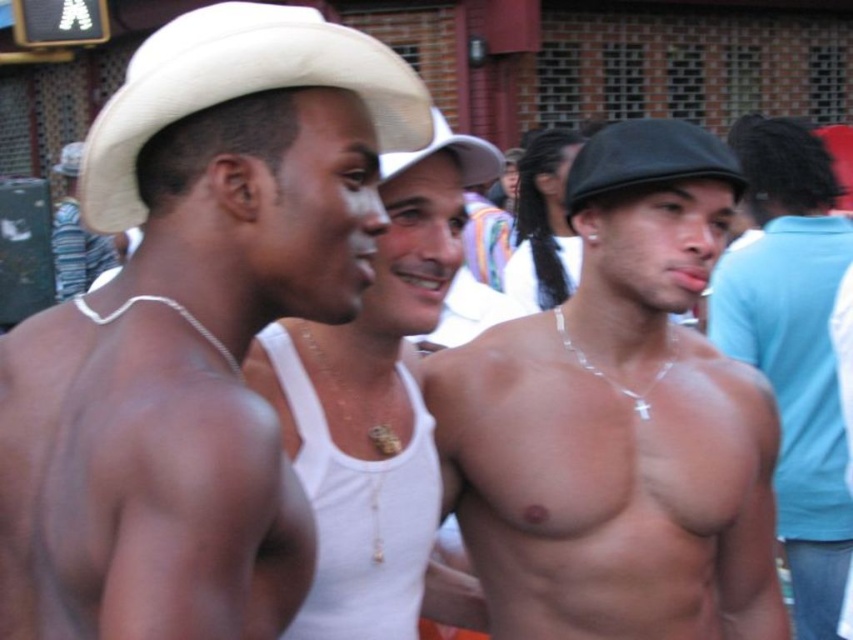
Question: Does matte white cowboy hat at left have a lesser width compared to strawmaterial/texturehat at center?

Choices:
 (A) yes
 (B) no

Answer: (B)

Question: Which is farther from the shiny silver necklace at center?

Choices:
 (A) white straw hat at upper left
 (B) white matte tank top at center
 (C) matte white cowboy hat at left

Answer: (C)

Question: From the image, what is the correct spatial relationship of shiny silver necklace at center in relation to white matte tank top at center?

Choices:
 (A) left
 (B) right

Answer: (B)

Question: Can you confirm if matte white cowboy hat at left is positioned below strawmaterial/texturehat at center?

Choices:
 (A) no
 (B) yes

Answer: (B)

Question: Which point is farther to the camera?

Choices:
 (A) (281, 208)
 (B) (286, 364)

Answer: (B)

Question: Among these objects, which one is nearest to the camera?

Choices:
 (A) white matte cowboy hat at upper left
 (B) smooth skin torso at center
 (C) white matte tank top at center

Answer: (A)